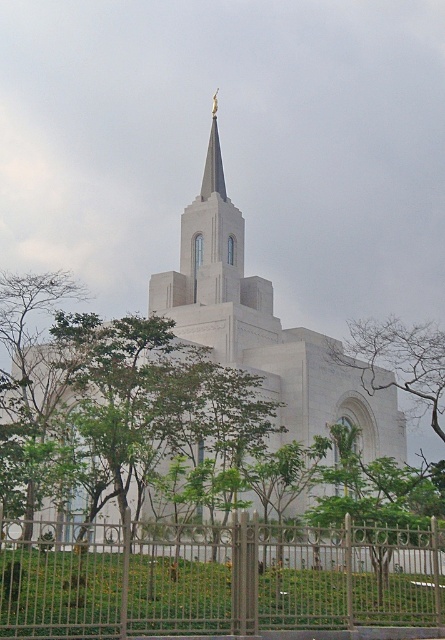
In the scene shown: Is metallic silver fence at lower center further to camera compared to gold polished spire at center?

No.

Does point (380, 556) come behind point (222, 180)?

No.

Is point (166, 563) positioned after point (207, 188)?

No.

The image size is (445, 640). What are the coordinates of `metallic silver fence at lower center` in the screenshot? It's located at (217, 579).

Can you confirm if green leafy tree at center is positioned above gold polished spire at center?

No, green leafy tree at center is not above gold polished spire at center.

Does point (348, 324) come farther from viewer compared to point (218, 172)?

That is True.

Where is `green leafy tree at center`? green leafy tree at center is located at coordinates (399, 360).

Between white stone church at center and green leafy tree at center, which one appears on the left side from the viewer's perspective?

Positioned to the left is white stone church at center.

Does white stone church at center appear over green leafy tree at center?

Incorrect, white stone church at center is not positioned above green leafy tree at center.

Locate an element on the screen. The width and height of the screenshot is (445, 640). white stone church at center is located at coordinates (267, 336).

The height and width of the screenshot is (640, 445). What are the coordinates of `white stone church at center` in the screenshot? It's located at (267, 336).